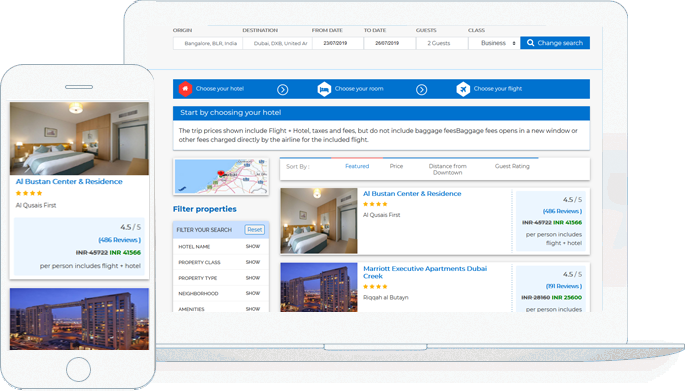
At what (x,y) coordinates should I click in order to perform the action: click on base or keyboard area of laptop. Please return your answer as a coordinate pair (x, y). Looking at the image, I should click on (563, 353).